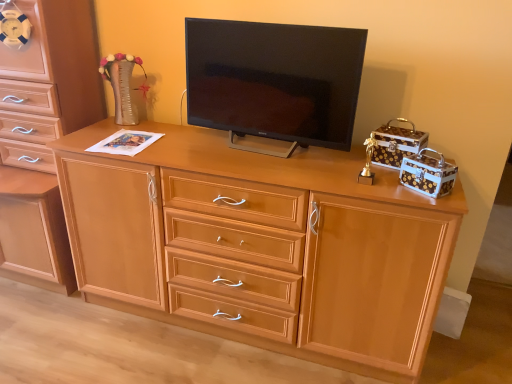
Question: From a real-world perspective, is light wood cabinet at center positioned under matte black tv at center based on gravity?

Choices:
 (A) no
 (B) yes

Answer: (B)

Question: From the image's perspective, is light wood cabinet at center on top of matte black tv at center?

Choices:
 (A) yes
 (B) no

Answer: (B)

Question: From a real-world perspective, does light wood cabinet at center stand above matte black tv at center?

Choices:
 (A) yes
 (B) no

Answer: (B)

Question: Is the position of light wood cabinet at center less distant than that of matte black tv at center?

Choices:
 (A) no
 (B) yes

Answer: (B)

Question: Does light wood cabinet at center come behind matte black tv at center?

Choices:
 (A) yes
 (B) no

Answer: (B)

Question: Considering the relative positions of light wood cabinet at center and matte black tv at center in the image provided, is light wood cabinet at center to the left of matte black tv at center from the viewer's perspective?

Choices:
 (A) no
 (B) yes

Answer: (B)

Question: Would you say light wood cabinet at center is a long distance from light brown wood chest of drawers at left?

Choices:
 (A) no
 (B) yes

Answer: (A)

Question: Is light wood cabinet at center surrounding light brown wood chest of drawers at left?

Choices:
 (A) yes
 (B) no

Answer: (B)

Question: Does light wood cabinet at center come in front of light brown wood chest of drawers at left?

Choices:
 (A) no
 (B) yes

Answer: (B)

Question: Is light wood cabinet at center outside of light brown wood chest of drawers at left?

Choices:
 (A) yes
 (B) no

Answer: (A)

Question: Is light wood cabinet at center oriented away from light brown wood chest of drawers at left?

Choices:
 (A) no
 (B) yes

Answer: (A)

Question: From the image's perspective, is light wood cabinet at center beneath light brown wood chest of drawers at left?

Choices:
 (A) no
 (B) yes

Answer: (B)

Question: From the image's perspective, is light brown wood chest of drawers at left above light wood cabinet at center?

Choices:
 (A) no
 (B) yes

Answer: (B)